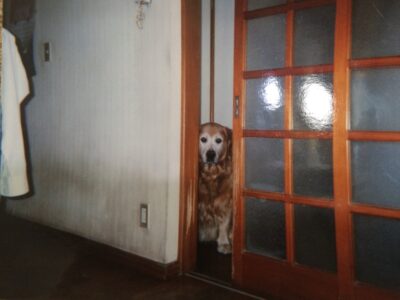
At what (x,y) coordinates should I click in order to perform the action: click on robe hanging. Please return your answer as a coordinate pair (x, y). Looking at the image, I should click on (10, 129).